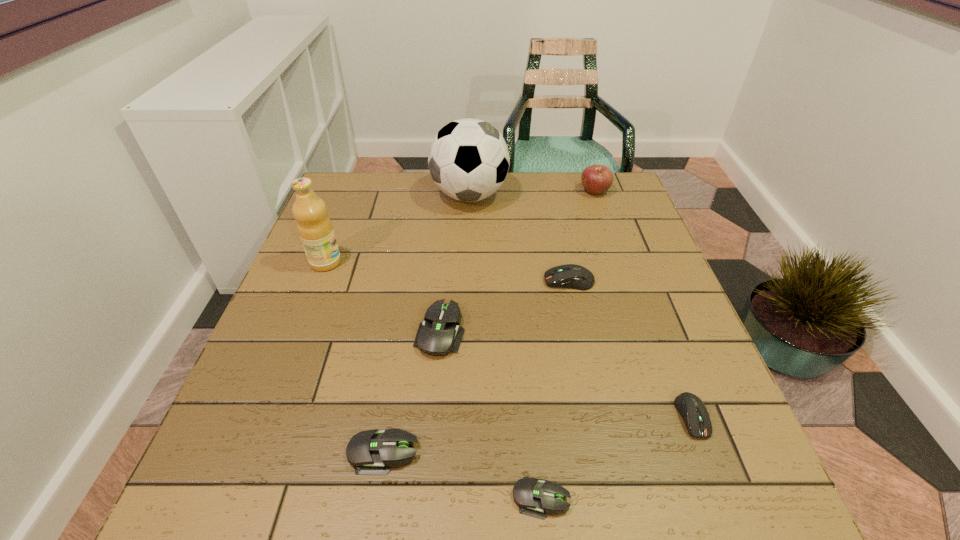
Find the location of a particular element. This screenshot has width=960, height=540. vacant space in between the apple and the second nearest gray computer mouse is located at coordinates (489, 322).

At what (x,y) coordinates should I click in order to perform the action: click on free space that is in between the rightmost computer mouse and the second nearest gray computer mouse. Please return your answer as a coordinate pair (x, y). This screenshot has height=540, width=960. Looking at the image, I should click on (538, 434).

You are a GUI agent. You are given a task and a screenshot of the screen. Output one action in this format:
    pyautogui.click(x=<x>, y=<y>)
    Task: Click on the free space that is in between the second smallest gray computer mouse and the nearest computer mouse
    This screenshot has height=540, width=960.
    Given the screenshot: What is the action you would take?
    pyautogui.click(x=463, y=475)

What are the coordinates of `empty location between the biggest gray computer mouse and the rightmost computer mouse` in the screenshot? It's located at (566, 374).

Identify the location of free point between the nearer dark computer equipment and the third tallest object. (643, 304).

Where is `object that is the sixth closest to the shortest object`? The width and height of the screenshot is (960, 540). object that is the sixth closest to the shortest object is located at coordinates (468, 160).

Locate an element on the screen. Image resolution: width=960 pixels, height=540 pixels. object that is the closest to the second farthest computer mouse is located at coordinates (370, 451).

At what (x,y) coordinates should I click in order to perform the action: click on the closest computer mouse to the sixth shortest object. Please return your answer as a coordinate pair (x, y). The height and width of the screenshot is (540, 960). Looking at the image, I should click on (572, 276).

Image resolution: width=960 pixels, height=540 pixels. Find the location of `the second closest computer mouse to the shortest computer mouse`. the second closest computer mouse to the shortest computer mouse is located at coordinates (693, 411).

Point out which gray computer mouse is positioned as the second nearest to the fourth nearest object. Please provide its 2D coordinates. Your answer should be formatted as a tuple, i.e. [(x, y)], where the tuple contains the x and y coordinates of a point satisfying the conditions above.

[(535, 497)]